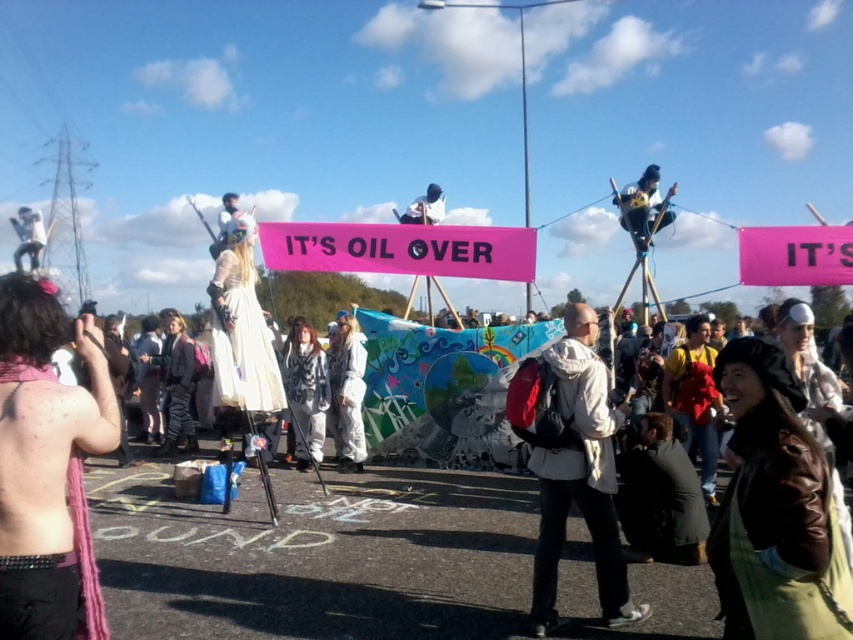
Who is higher up, pink scarf at lower left or white textured coat at center?

pink scarf at lower left

From the picture: Does pink scarf at lower left appear over white textured coat at center?

Correct, pink scarf at lower left is located above white textured coat at center.

Is point (4, 467) less distant than point (285, 352)?

Yes, point (4, 467) is in front of point (285, 352).

What are the coordinates of `pink scarf at lower left` in the screenshot? It's located at (47, 467).

Is point (840, 545) positioned before point (22, 227)?

Yes, point (840, 545) is closer to viewer.

Who is more distant from viewer, [801,451] or [32,225]?

Positioned behind is point [32,225].

Where is `brown leather jacket at lower right`? This screenshot has height=640, width=853. brown leather jacket at lower right is located at coordinates (775, 509).

Does pink fabric banner at center appear over pink fabric banner at upper center?

Yes, pink fabric banner at center is above pink fabric banner at upper center.

Who is more distant from viewer, (378, 260) or (828, 232)?

The point (378, 260) is behind.

What do you see at coordinates (399, 250) in the screenshot? This screenshot has width=853, height=640. I see `pink fabric banner at center` at bounding box center [399, 250].

Identify the location of pink fabric banner at center. This screenshot has width=853, height=640. (399, 250).